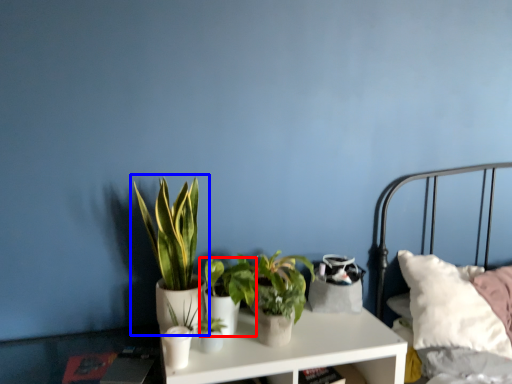
Question: Which object appears closest to the camera in this image, houseplant (highlighted by a red box) or houseplant (highlighted by a blue box)?

Choices:
 (A) houseplant
 (B) houseplant

Answer: (B)